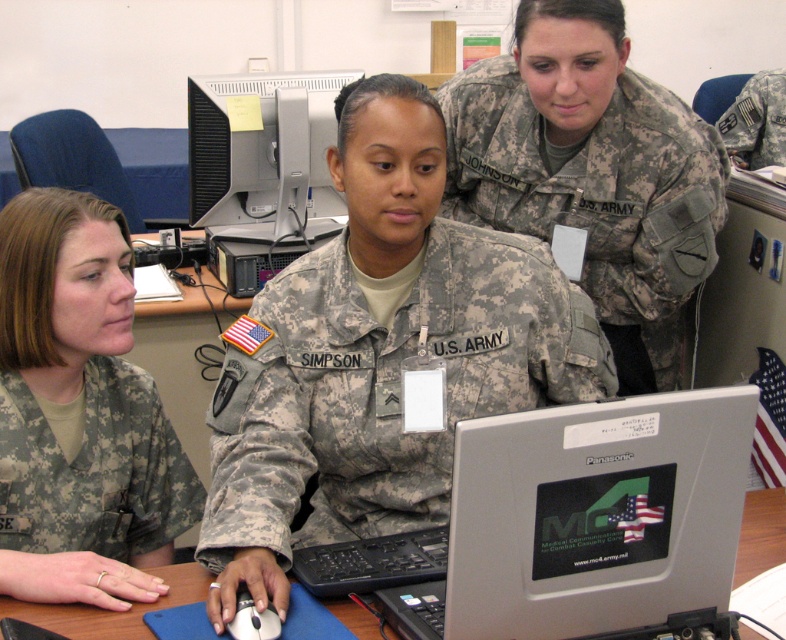
You are a military trainee who needs to identify the correct uniform for a field exercise. Given the camouflage uniform at left and the camouflage fabric uniform at left, which one is positioned to the right of the other?

The camouflage uniform at left is positioned on the right side of camouflage fabric uniform at left.

You are a military supply officer tasked with organizing uniforms. You notice two uniforms labeled as camouflage uniform at left and camouflage fabric uniform at left. Which one has a greater width?

The camouflage uniform at left has a greater width than the camouflage fabric uniform at left according to the description provided.